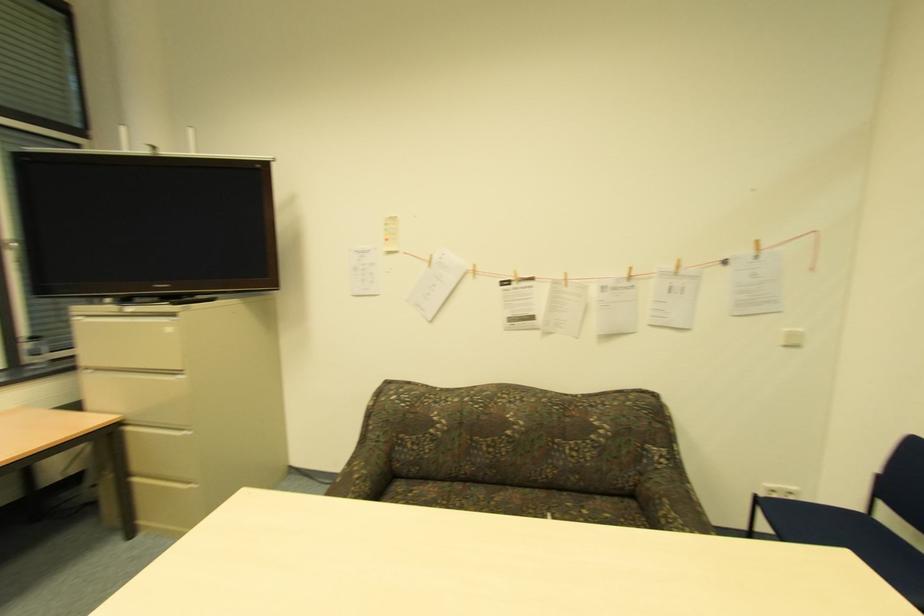
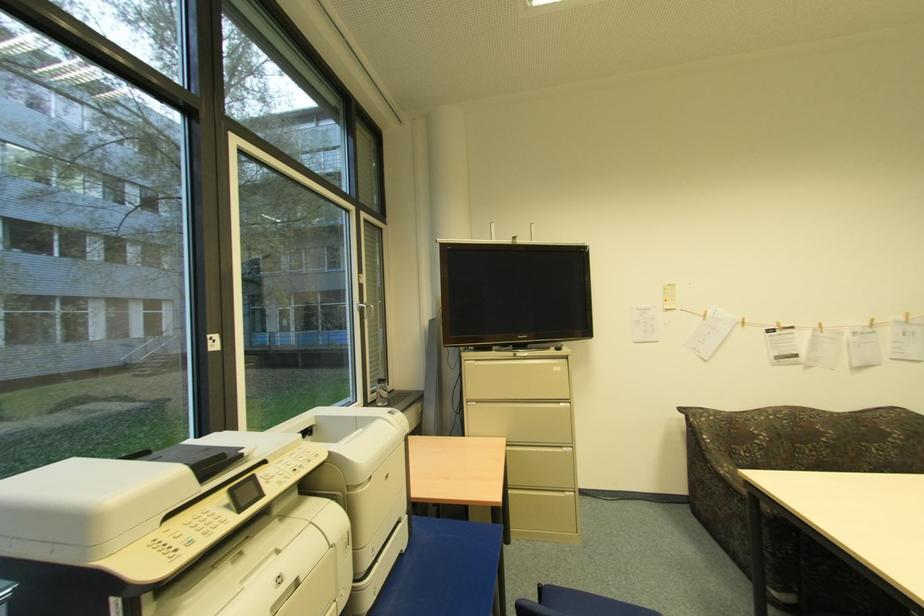
Question: The images are taken continuously from a first-person perspective. In which direction are you moving?

Choices:
 (A) Left
 (B) Right
 (C) Forward
 (D) Backward

Answer: (A)